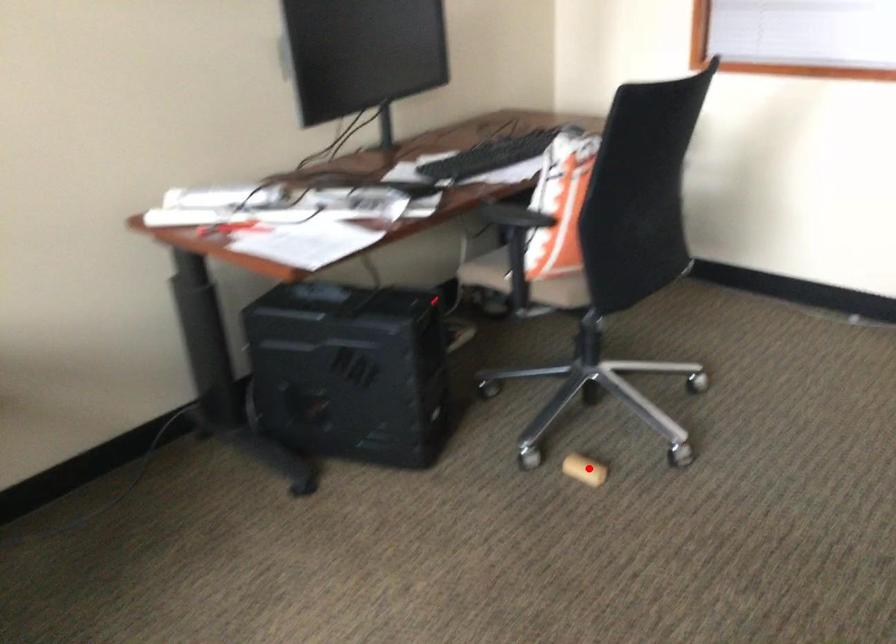
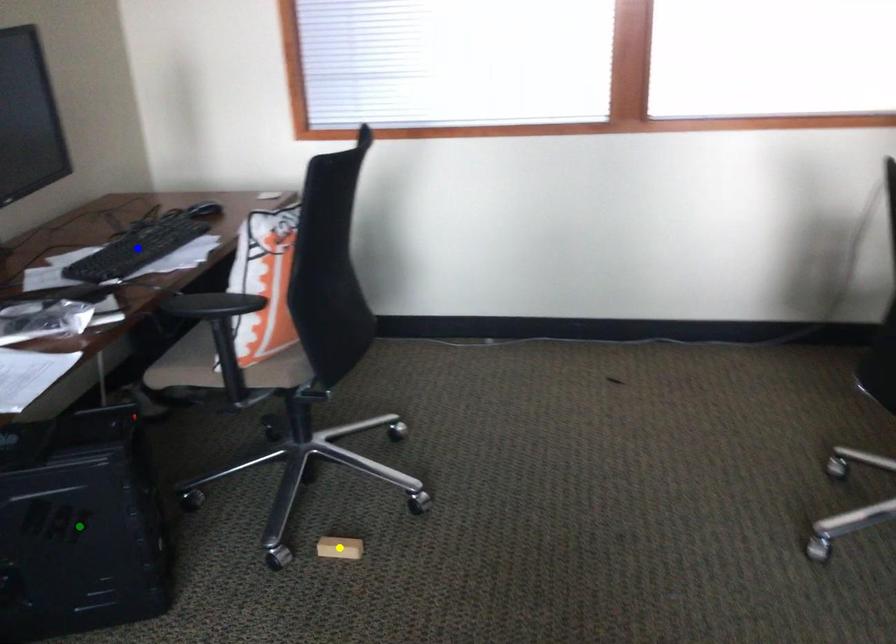
Question: I am providing you with two images of the same scene from different viewpoints. A red point is marked on the first image. You are given multiple points on the second image. Which point in image 2 represents the same 3d spot as the red point in image 1?

Choices:
 (A) yellow point
 (B) green point
 (C) blue point

Answer: (A)